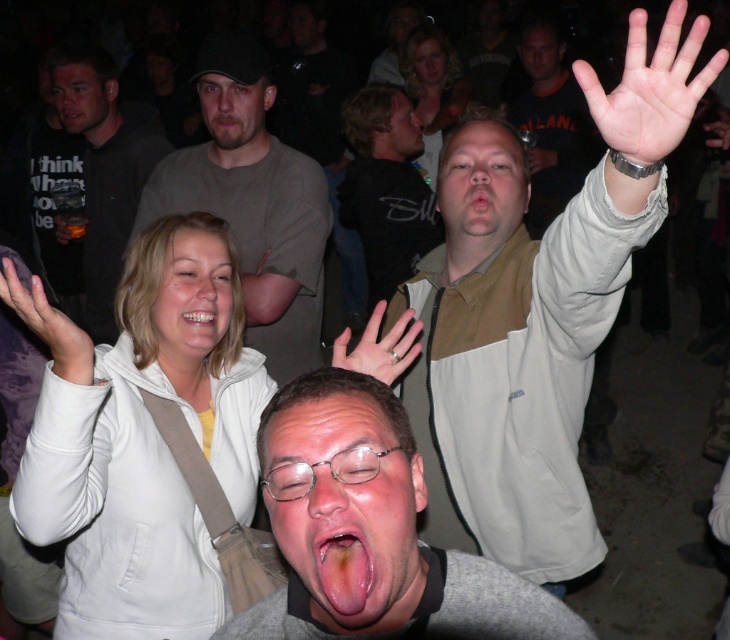
Which is more to the left, smooth beige jacket at center or blonde hair at upper center?

Positioned to the left is smooth beige jacket at center.

Who is shorter, smooth beige jacket at center or blonde hair at upper center?

smooth beige jacket at center is shorter.

This screenshot has width=730, height=640. I want to click on smooth beige jacket at center, so click(x=480, y=184).

Can you confirm if bearded man at center is taller than matte black face at upper center?

In fact, bearded man at center may be shorter than matte black face at upper center.

Consider the image. Which of these two, bearded man at center or matte black face at upper center, stands shorter?

bearded man at center is shorter.

Between point (207, 74) and point (550, 38), which one is positioned in front?

Positioned in front is point (207, 74).

Locate an element on the screen. The width and height of the screenshot is (730, 640). bearded man at center is located at coordinates (234, 116).

Who is lower down, matte black face at center or smooth skin face at center?

Positioned lower is matte black face at center.

Where is `matte black face at center`? The width and height of the screenshot is (730, 640). matte black face at center is located at coordinates (402, 131).

This screenshot has height=640, width=730. Identify the location of matte black face at center. (402, 131).